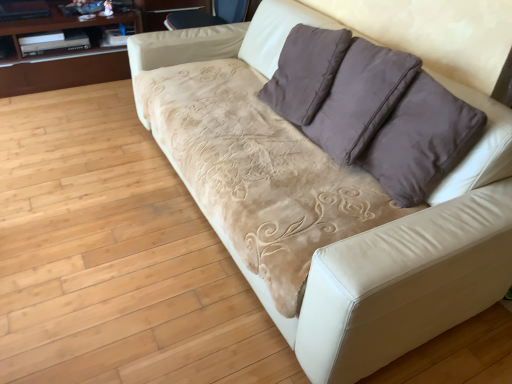
Question: From the image's perspective, is brown suede pillow at upper right above or below wooden glossy dresser at upper left?

Choices:
 (A) above
 (B) below

Answer: (B)

Question: From a real-world perspective, relative to wooden glossy dresser at upper left, is brown suede pillow at upper right vertically above or below?

Choices:
 (A) below
 (B) above

Answer: (B)

Question: Which is nearer to the wooden glossy dresser at upper left?

Choices:
 (A) velvet beige armchair at upper center
 (B) brown suede pillow at upper right

Answer: (A)

Question: Which of these objects is positioned farthest from the wooden glossy dresser at upper left?

Choices:
 (A) brown suede pillow at upper right
 (B) velvet beige armchair at upper center

Answer: (A)